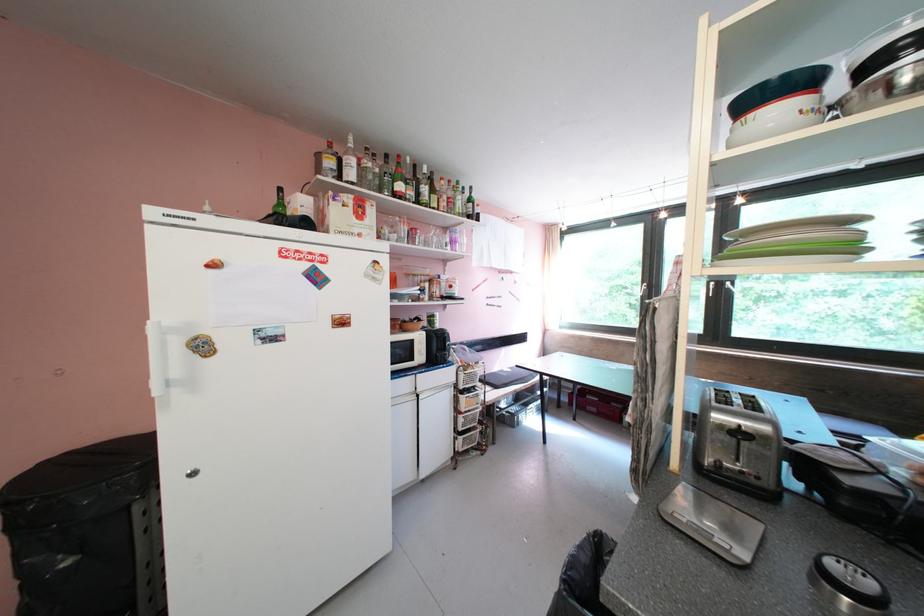
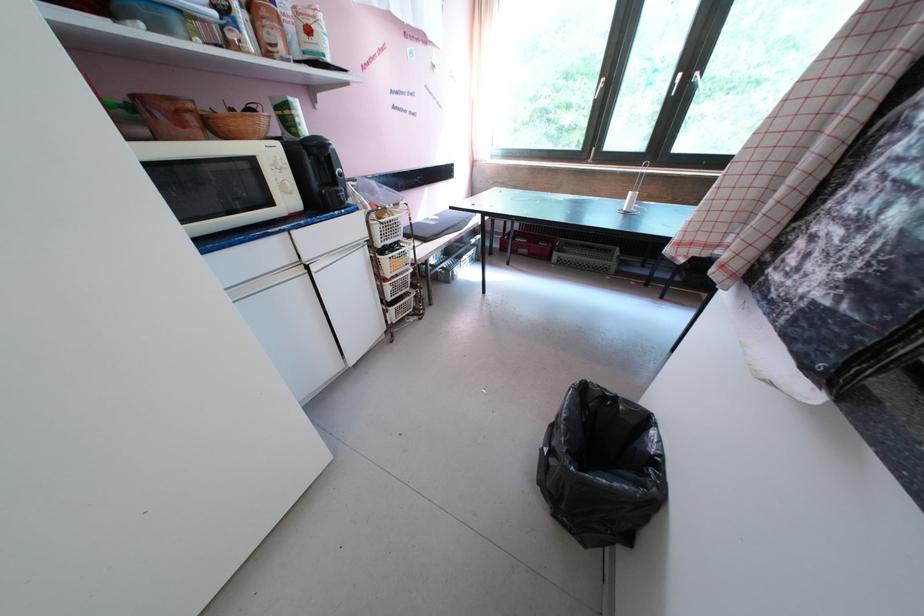
First-person continuous shooting, in which direction is the camera rotating?

The rotation direction of the camera is right-down.